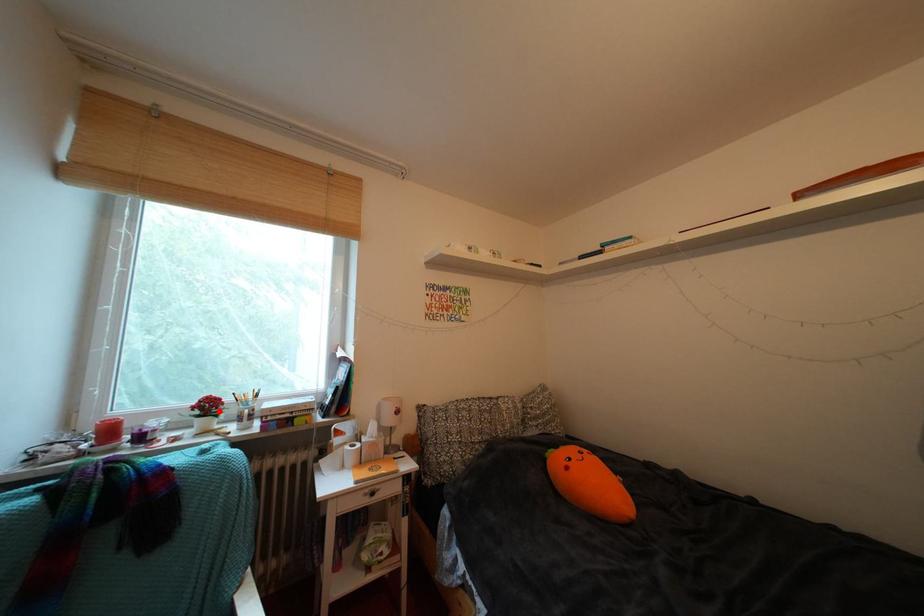
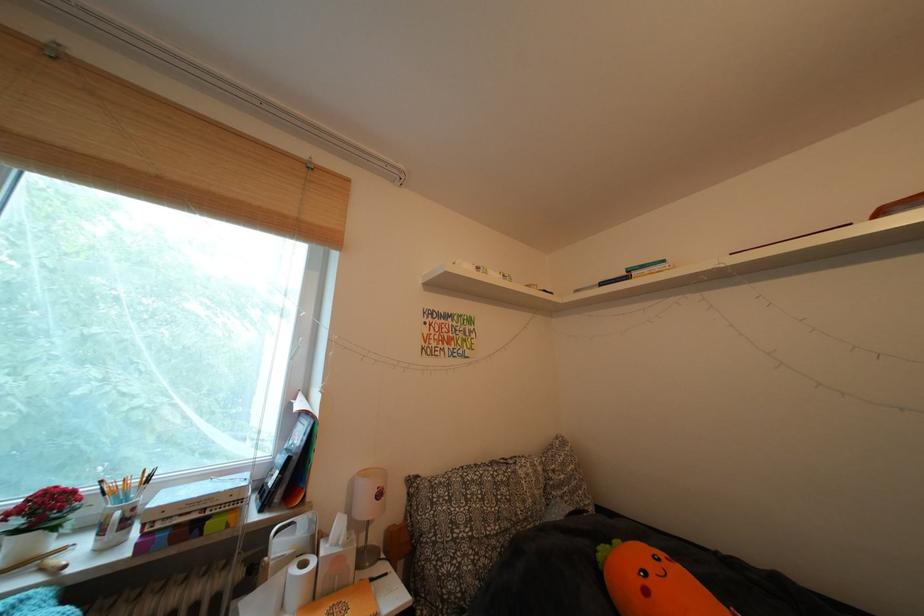
Question: I am providing you with two images of the same scene from different viewpoints. A red point is shown in image1. For the corresponding object point in image2, is it positioned nearer or farther from the camera?

Choices:
 (A) Nearer
 (B) Farther

Answer: (A)